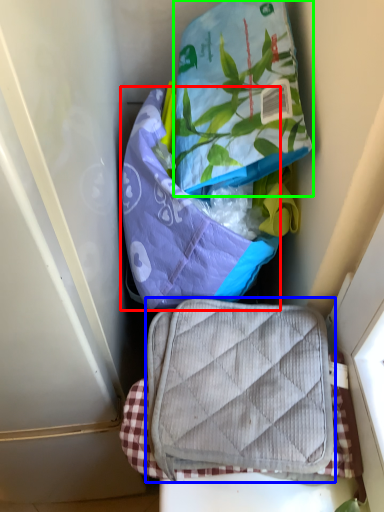
Question: Which object is positioned closest to pouch (highlighted by a red box)? Select from luggage and bags (highlighted by a blue box) and pouch (highlighted by a green box).

Choices:
 (A) luggage and bags
 (B) pouch

Answer: (B)